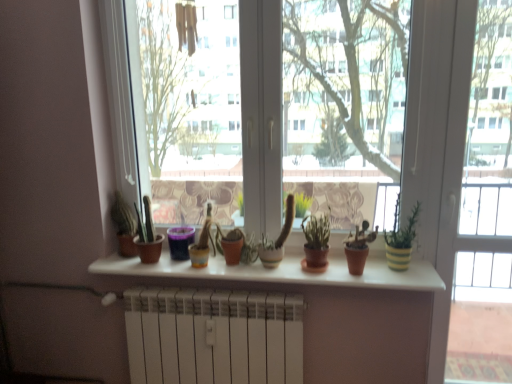
Question: Is purple plastic cup at center, the first flowerpot when ordered from left to right, taller or shorter than transparent glass window at center?

Choices:
 (A) short
 (B) tall

Answer: (A)

Question: From the image's perspective, is purple plastic cup at center, the first flowerpot when ordered from left to right, above or below transparent glass window at center?

Choices:
 (A) below
 (B) above

Answer: (A)

Question: Considering the real-world distances, which object is closest to the matte white shelf at center?

Choices:
 (A) transparent glass screen door at right
 (B) purple plastic cup at center, the first flowerpot when ordered from left to right
 (C) matte terracotta pot at center, which is the 1th flowerpot from right to left
 (D) yellow striped pot at right, which is the second houseplant from left to right
 (E) white matte radiator at lower center

Answer: (E)

Question: Which object is positioned closest to the white matte radiator at lower center?

Choices:
 (A) yellow striped pot at right, the 1th houseplant positioned from the right
 (B) transparent glass window at center
 (C) matte white shelf at center
 (D) transparent glass screen door at right
 (E) matte terracotta pot at center, arranged as the second flowerpot when viewed from the left

Answer: (C)